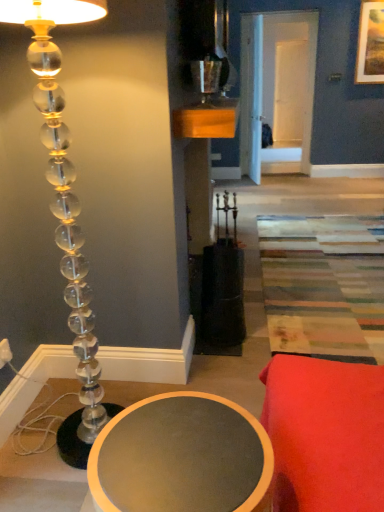
Locate an element on the screen. This screenshot has width=384, height=512. free region on the left part of clear acrylic lamp at left is located at coordinates (31, 440).